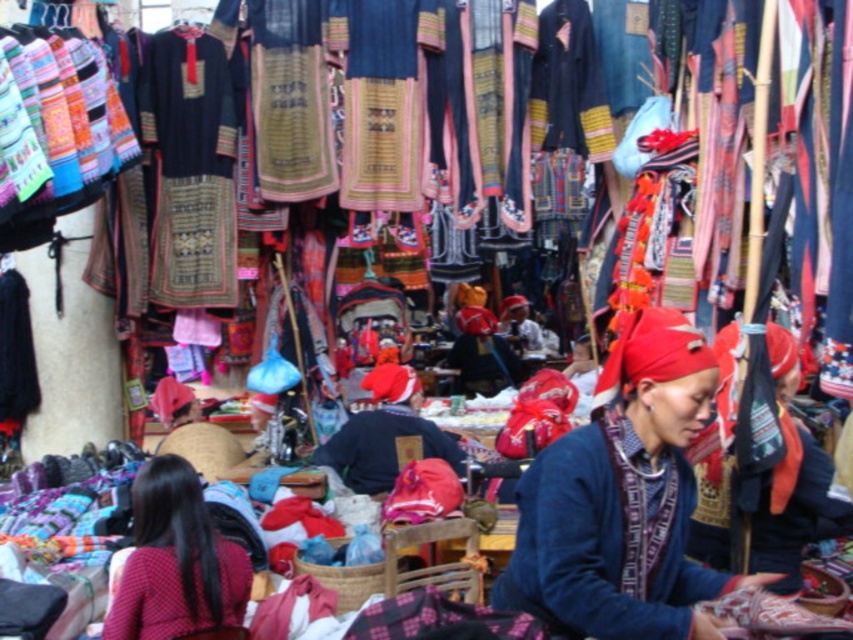
How far apart are blue woven sweater at center and dark blue fabric at center?

A distance of 3.16 meters exists between blue woven sweater at center and dark blue fabric at center.

Locate an element on the screen. blue woven sweater at center is located at coordinates (606, 538).

Can you confirm if red fabric headscarf at lower left is taller than dark blue fabric at center?

Yes, red fabric headscarf at lower left is taller than dark blue fabric at center.

Between red fabric headscarf at lower left and dark blue fabric at center, which one has less height?

dark blue fabric at center is shorter.

Locate an element on the screen. Image resolution: width=853 pixels, height=640 pixels. red fabric headscarf at lower left is located at coordinates (177, 563).

Where is `red fabric headscarf at lower left`? This screenshot has height=640, width=853. red fabric headscarf at lower left is located at coordinates (177, 563).

Which of these two, blue woven sweater at center or red fabric headscarf at lower left, stands taller?

With more height is blue woven sweater at center.

Is point (613, 536) positioned after point (137, 611)?

That is False.

Who is more forward, [657,483] or [164,596]?

Point [657,483] is more forward.

This screenshot has height=640, width=853. I want to click on blue woven sweater at center, so click(606, 538).